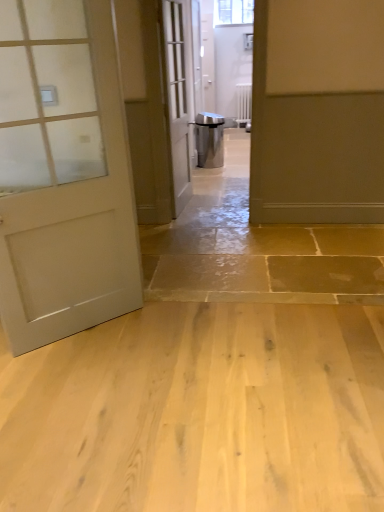
Where is `free space in front of matte white door at left, the third door viewed from the back`? The image size is (384, 512). free space in front of matte white door at left, the third door viewed from the back is located at coordinates (79, 381).